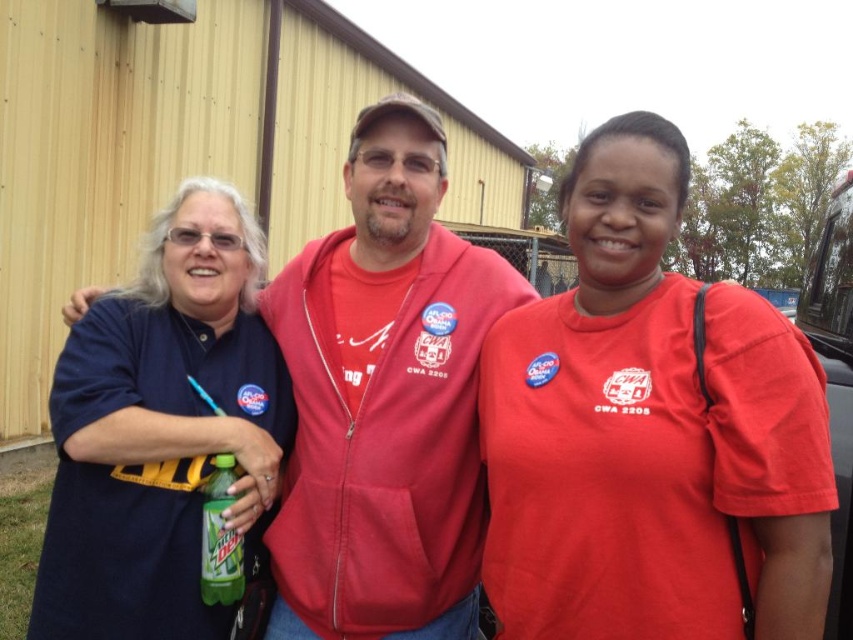
You are standing in front of the yellow corrugated metal building and see two points marked in the image. Which point is closer to you, point (688,168) or point (352,214)?

Point (688,168) is closer to the viewer than point (352,214).

You are a photographer trying to capture a photo of the matte red shirt at center and the green matte mountain dew bottle at center. From the perspective of someone standing in front of the scene, which object is located to the right of the other?

The matte red shirt at center is positioned on the right side of the green matte mountain dew bottle at center, so the matte red shirt at center is to the right of the green matte mountain dew bottle at center.